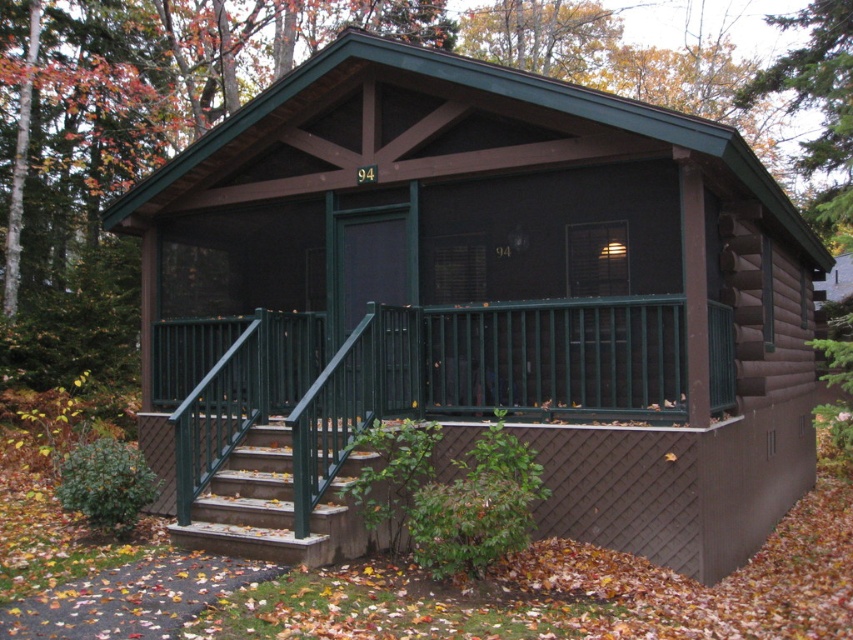
Does green metal railing at center lie in front of green concrete stairs at lower left?

No, green metal railing at center is behind green concrete stairs at lower left.

This screenshot has width=853, height=640. What do you see at coordinates (410, 376) in the screenshot? I see `green metal railing at center` at bounding box center [410, 376].

Is point (231, 433) behind point (230, 508)?

Yes, point (231, 433) is farther from viewer.

At what (x,y) coordinates should I click in order to perform the action: click on green metal railing at center. Please return your answer as a coordinate pair (x, y). The width and height of the screenshot is (853, 640). Looking at the image, I should click on (410, 376).

Can you confirm if green metal railing at center is wider than green wood tree at upper right?

Incorrect, green metal railing at center's width does not surpass green wood tree at upper right's.

Is green metal railing at center shorter than green wood tree at upper right?

Yes.

Is point (265, 416) positioned after point (838, 1)?

No, it is not.

Where is `green metal railing at center`? green metal railing at center is located at coordinates (410, 376).

Does point (277, 541) come behind point (807, 22)?

No, (277, 541) is closer to viewer.

Can you confirm if green concrete stairs at lower left is positioned below green wood tree at upper right?

Correct, green concrete stairs at lower left is located below green wood tree at upper right.

Is point (247, 545) positioned before point (828, 93)?

Yes, point (247, 545) is closer to viewer.

Where is `green concrete stairs at lower left`? Image resolution: width=853 pixels, height=640 pixels. green concrete stairs at lower left is located at coordinates (271, 506).